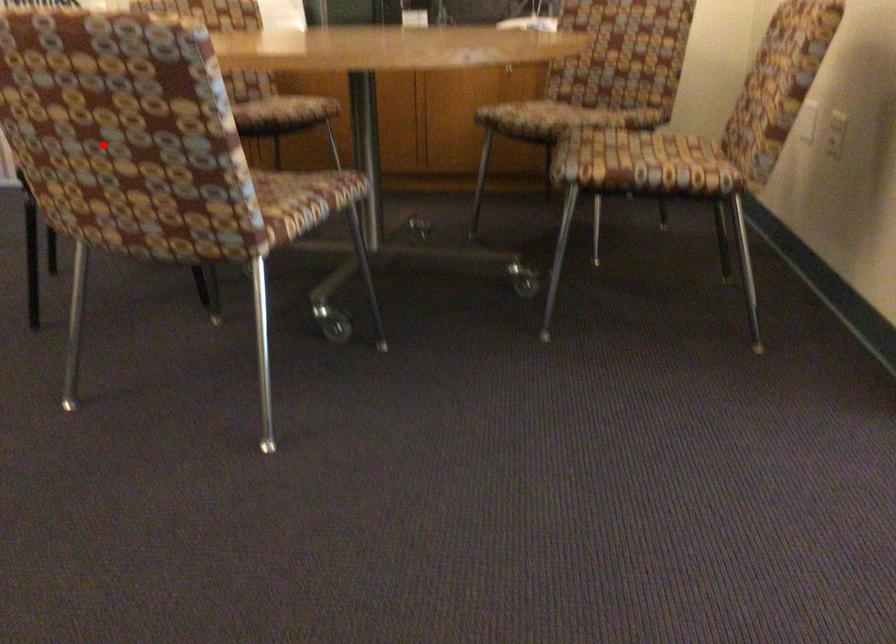
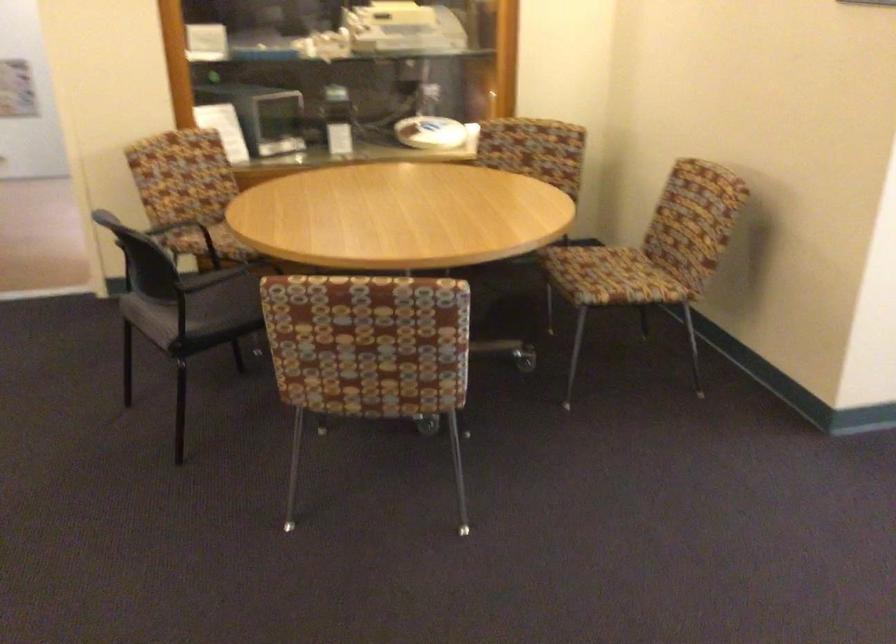
Find the pixel in the second image that matches the highlighted location in the first image.

(368, 353)